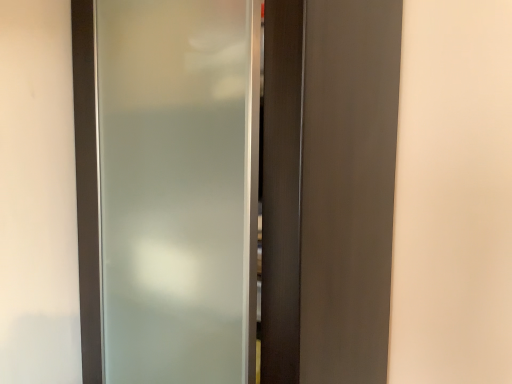
This screenshot has width=512, height=384. What are the coordinates of `frosted glass door at center` in the screenshot? It's located at (234, 188).

What is the approximate width of frosted glass door at center?

frosted glass door at center is 16.68 inches in width.

The image size is (512, 384). What do you see at coordinates (234, 188) in the screenshot? I see `frosted glass door at center` at bounding box center [234, 188].

Based on the photo, in order to face frosted glass door at center, should I rotate leftwards or rightwards?

To align with it, rotate left about 4.322°.

Identify the location of frosted glass door at center. This screenshot has height=384, width=512. (234, 188).